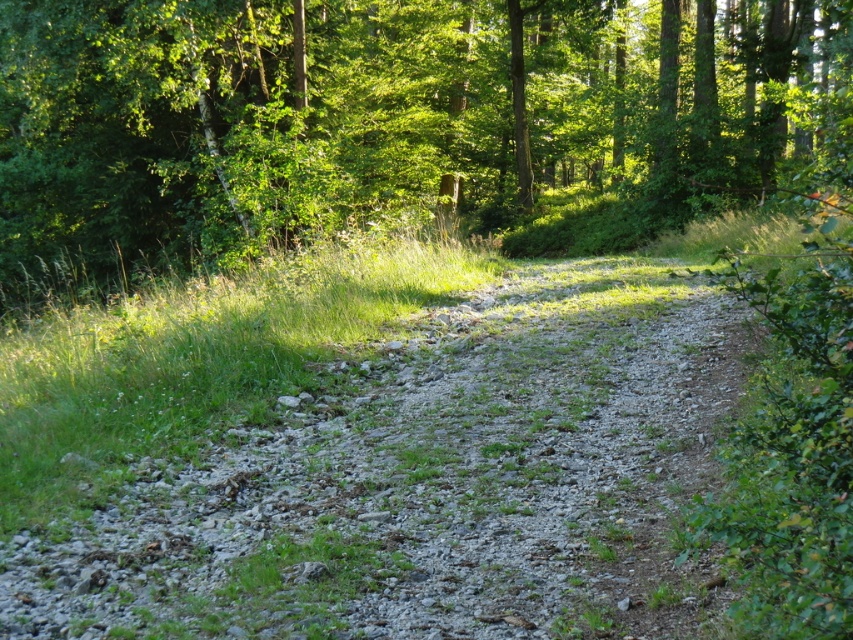
You are a hiker navigating the forest path and want to reach the two points marked in the scene. Which point, point (233, 113) or point (648, 465), is closer to you as you stand on the path?

Point (233, 113) is closer to you because it is further to the viewer than point (648, 465).

You are a hiker trying to navigate the gray gravel path at center. You notice the green leafy tree at upper center. Which one is wider in terms of their spread?

The green leafy tree at upper center is wider than the gray gravel path at center in terms of their spread.

Consider the image. You are standing at the origin point of the forest scene. A green leafy tree is located at coordinates point 0.188, 0.447. If you move 0.1 units north, will you be closer to the green leafy tree at upper center?

Moving 0.1 units north from the origin point would bring you closer to the green leafy tree at upper center located at point (380, 120), since northward movement in this coordinate system typically increases the y coordinate. The tree is at y 0.447, so moving north would increase your y coordinate towards that of the tree, thus reducing the distance between you and the tree.